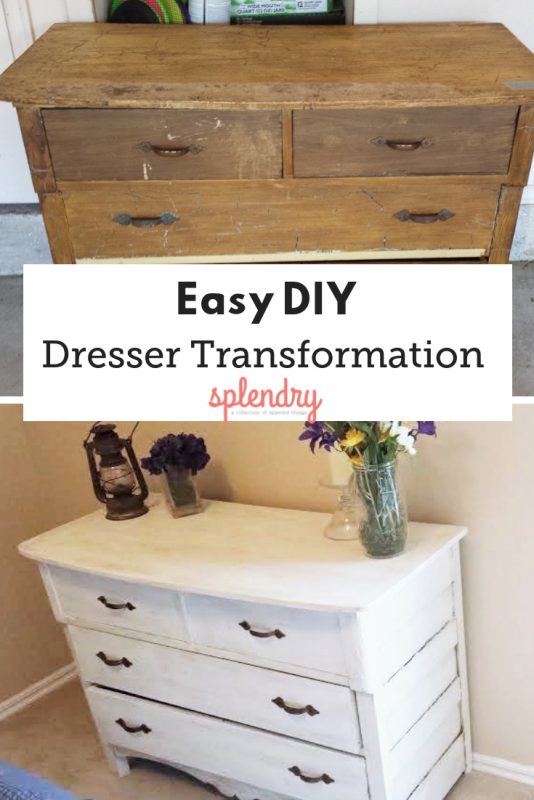
You are a GUI agent. You are given a task and a screenshot of the screen. Output one action in this format:
    pyautogui.click(x=<x>, y=<y>)
    Task: Click on the wall
    This screenshot has height=800, width=534.
    Given the screenshot: What is the action you would take?
    pyautogui.click(x=43, y=478), pyautogui.click(x=264, y=458), pyautogui.click(x=500, y=502)